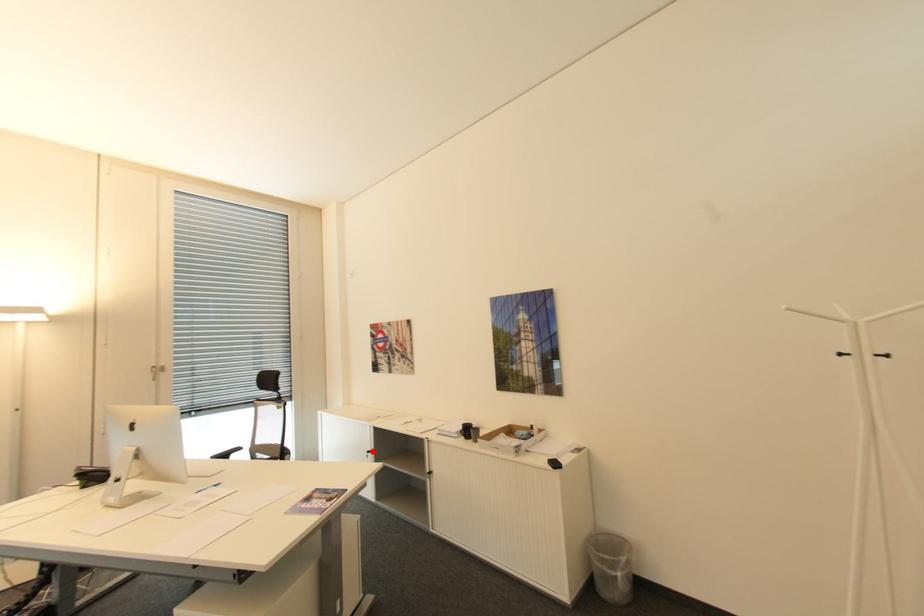
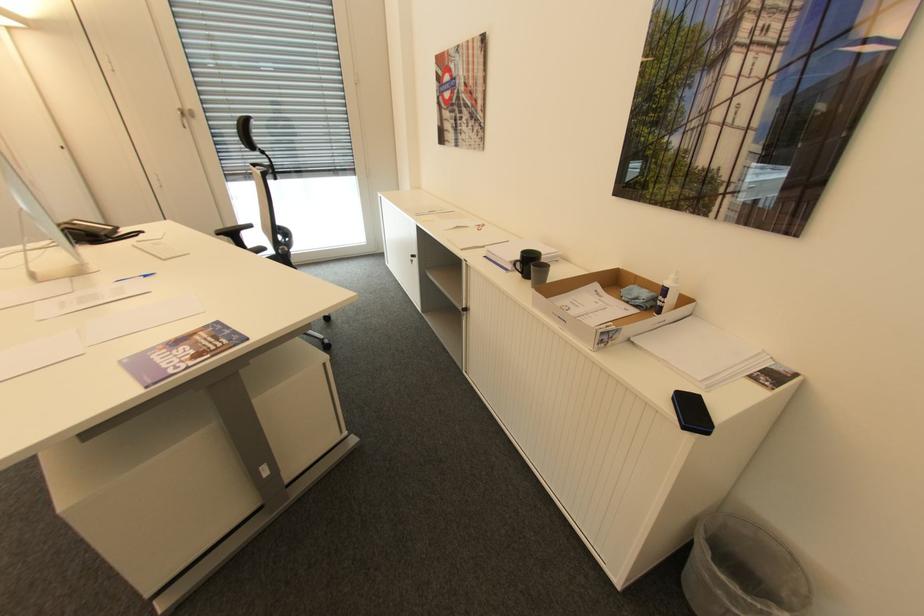
Question: I am providing you with two images of the same scene from different viewpoints. Image1 has a red point marked. In image2, the corresponding 3D location appears at what relative position? Reply with the corresponding letter.

Choices:
 (A) Closer
 (B) Farther

Answer: (A)